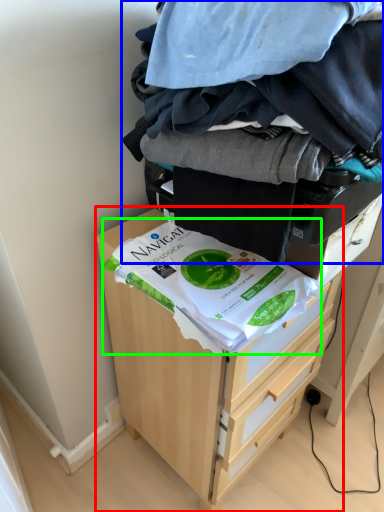
Question: Estimate the real-world distances between objects in this image. Which object is farther from chest of drawers (highlighted by a red box), laundry (highlighted by a blue box) or food (highlighted by a green box)?

Choices:
 (A) laundry
 (B) food

Answer: (A)